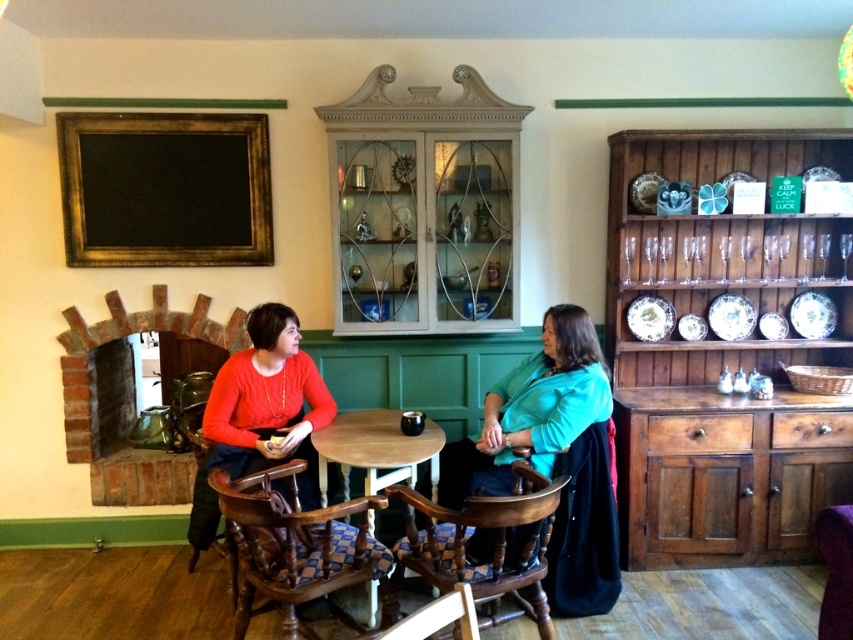
Between teal fabric shawl at center and light brown wooden table at center, which one has less height?

light brown wooden table at center is shorter.

Who is positioned more to the right, teal fabric shawl at center or light brown wooden table at center?

teal fabric shawl at center is more to the right.

Where is `teal fabric shawl at center`? teal fabric shawl at center is located at coordinates (531, 410).

Is gold-toned wooden frame at upper left taller than wooden polished chair at center?

Indeed, gold-toned wooden frame at upper left has a greater height compared to wooden polished chair at center.

Does point (215, 262) come farther from viewer compared to point (373, 573)?

Yes.

Is point (94, 184) more distant than point (312, 561)?

Yes, point (94, 184) is behind point (312, 561).

Locate an element on the screen. gold-toned wooden frame at upper left is located at coordinates (165, 188).

Does wooden chair with checkered upholstery at center appear under light brown wooden table at center?

Yes.

Who is lower down, wooden chair with checkered upholstery at center or light brown wooden table at center?

wooden chair with checkered upholstery at center is below.

What do you see at coordinates (492, 545) in the screenshot? The height and width of the screenshot is (640, 853). I see `wooden chair with checkered upholstery at center` at bounding box center [492, 545].

You are a GUI agent. You are given a task and a screenshot of the screen. Output one action in this format:
    pyautogui.click(x=<x>, y=<y>)
    Task: Click on the wooden chair with checkered upholstery at center
    This screenshot has height=640, width=853.
    Given the screenshot: What is the action you would take?
    pyautogui.click(x=492, y=545)